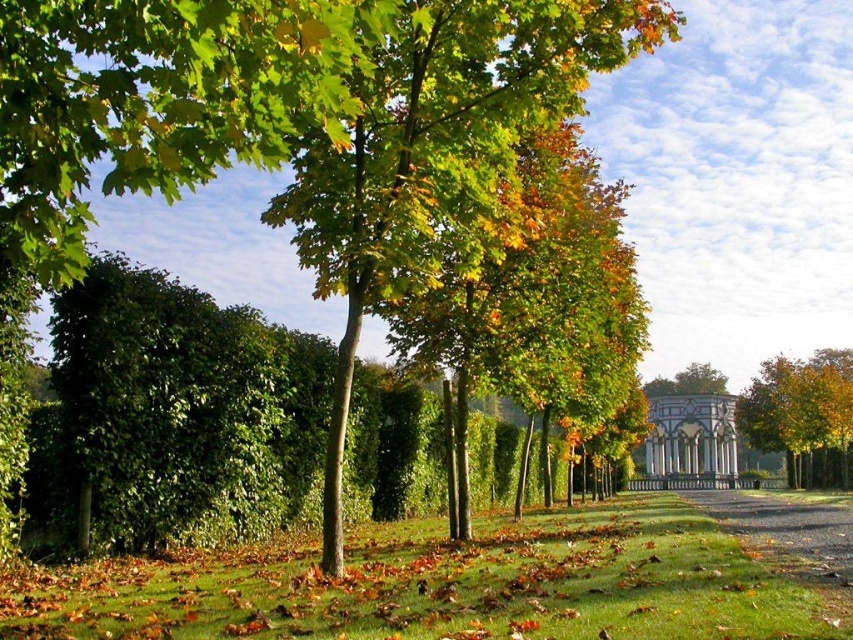
Is green leafy tree at center taller than white marble gazebo at center?

Correct, green leafy tree at center is much taller as white marble gazebo at center.

How far apart are green leafy tree at center and white marble gazebo at center?

green leafy tree at center is 90.10 meters from white marble gazebo at center.

Locate an element on the screen. This screenshot has width=853, height=640. green leafy tree at center is located at coordinates (289, 120).

Who is positioned more to the left, green leafy tree at center or green leafy hedge at center?

From the viewer's perspective, green leafy hedge at center appears more on the left side.

Between point (503, 109) and point (357, 488), which one is positioned in front?

Point (503, 109) is in front.

Locate an element on the screen. This screenshot has height=640, width=853. green leafy tree at center is located at coordinates (289, 120).

Where is `green leafy tree at center`? The width and height of the screenshot is (853, 640). green leafy tree at center is located at coordinates (289, 120).

Is point (601, 52) positioned behind point (303, 540)?

No, (601, 52) is in front of (303, 540).

Does point (158, 138) lie in front of point (573, 620)?

Yes.

I want to click on green leafy tree at center, so click(x=289, y=120).